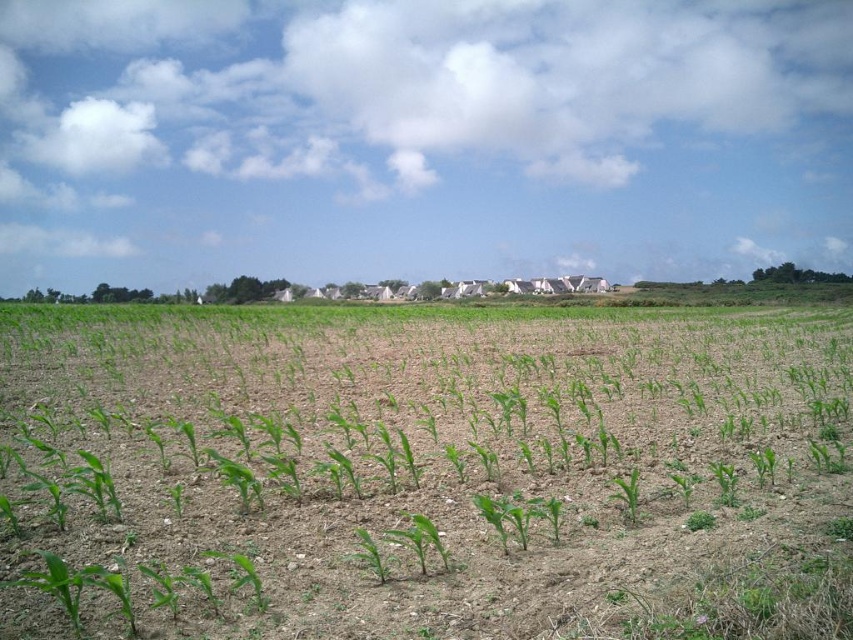
Question: Is green leafy corn at center to the right of green matte plant at center from the viewer's perspective?

Choices:
 (A) yes
 (B) no

Answer: (B)

Question: Among these objects, which one is nearest to the camera?

Choices:
 (A) green leafy corn at center
 (B) green matte plant at center

Answer: (A)

Question: Which object appears closest to the camera in this image?

Choices:
 (A) green matte plant at center
 (B) green leafy corn at center

Answer: (B)

Question: Does green leafy corn at center appear on the left side of green matte plant at center?

Choices:
 (A) yes
 (B) no

Answer: (A)

Question: Which point appears closest to the camera in this image?

Choices:
 (A) (636, 486)
 (B) (462, 596)

Answer: (B)

Question: Can you confirm if green leafy corn at center is positioned to the left of green matte plant at center?

Choices:
 (A) yes
 (B) no

Answer: (A)